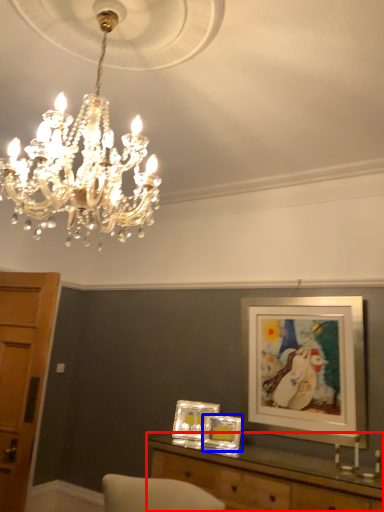
Question: Which point is further to the camera, table (highlighted by a red box) or picture frame (highlighted by a blue box)?

Choices:
 (A) table
 (B) picture frame

Answer: (B)